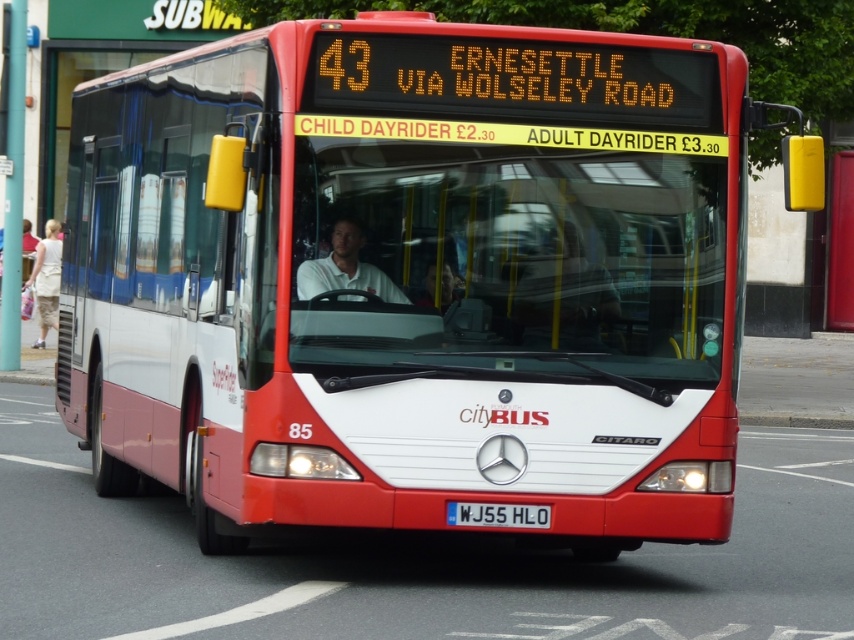
Between white matte shirt at center and white metallic license plate at center, which one has less height?

With less height is white metallic license plate at center.

Between white matte shirt at center and white metallic license plate at center, which one has more height?

white matte shirt at center

I want to click on white matte shirt at center, so [x=344, y=268].

You are a GUI agent. You are given a task and a screenshot of the screen. Output one action in this format:
    pyautogui.click(x=<x>, y=<y>)
    Task: Click on the white matte shirt at center
    
    Given the screenshot: What is the action you would take?
    pyautogui.click(x=344, y=268)

Can you confirm if white textured dress at lower left is thinner than white metallic license plate at center?

Incorrect, white textured dress at lower left's width is not less than white metallic license plate at center's.

Is point (34, 268) in front of point (487, 518)?

That is False.

Find the location of a particular element. Image resolution: width=854 pixels, height=640 pixels. white textured dress at lower left is located at coordinates (45, 280).

From the picture: Between white matte shirt at center and white textured dress at lower left, which one has less height?

Standing shorter between the two is white matte shirt at center.

Does white matte shirt at center have a lesser width compared to white textured dress at lower left?

Indeed, white matte shirt at center has a lesser width compared to white textured dress at lower left.

Is point (363, 280) less distant than point (50, 278)?

That is True.

Find the location of a particular element. This screenshot has width=854, height=640. white matte shirt at center is located at coordinates (344, 268).